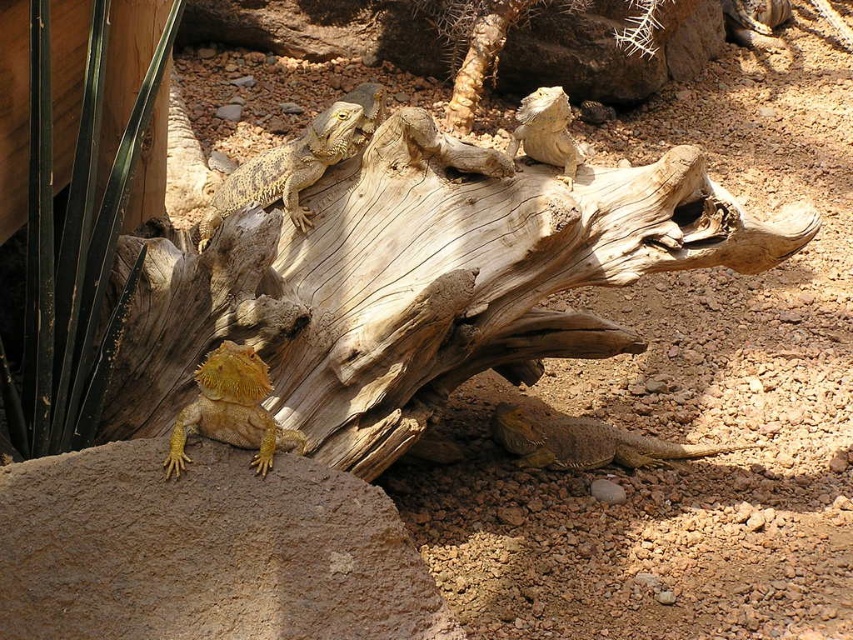
Question: Which point is farther from the camera taking this photo?

Choices:
 (A) (288, 448)
 (B) (202, 244)
 (C) (554, 112)
 (D) (550, 422)

Answer: (D)

Question: Does yellowish scaly lizard at upper center have a larger size compared to yellow scaly lizard at lower left?

Choices:
 (A) no
 (B) yes

Answer: (B)

Question: Which of the following is the closest to the observer?

Choices:
 (A) yellowish-brown scaly lizard at lower right
 (B) beige scaly lizard at upper center
 (C) yellowish scaly lizard at upper center
 (D) yellow scaly lizard at lower left

Answer: (D)

Question: Among these points, which one is nearest to the camera?

Choices:
 (A) (648, 449)
 (B) (531, 128)

Answer: (B)

Question: Observing the image, what is the correct spatial positioning of yellowish scaly lizard at upper center in reference to yellow scaly lizard at lower left?

Choices:
 (A) right
 (B) left

Answer: (A)

Question: Can you confirm if yellowish scaly lizard at upper center is positioned below yellow scaly lizard at lower left?

Choices:
 (A) no
 (B) yes

Answer: (A)